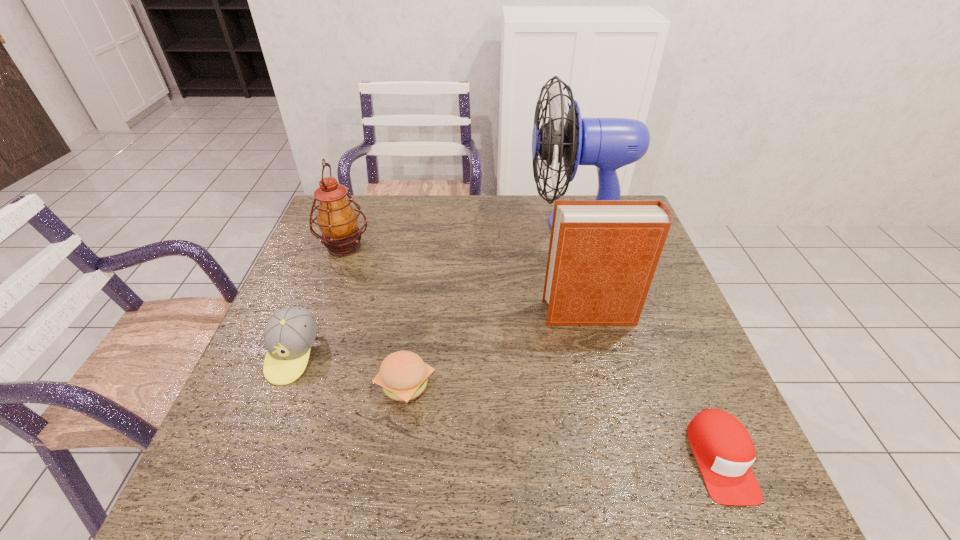
You are a GUI agent. You are given a task and a screenshot of the screen. Output one action in this format:
    pyautogui.click(x=<x>, y=<y>)
    Task: Click on the oil lamp situated at the left edge
    This screenshot has width=960, height=540.
    Given the screenshot: What is the action you would take?
    pyautogui.click(x=337, y=220)

At what (x,y) coordinates should I click in order to perform the action: click on baseball cap that is positioned at the left edge. Please return your answer as a coordinate pair (x, y). The height and width of the screenshot is (540, 960). Looking at the image, I should click on (290, 332).

This screenshot has width=960, height=540. In order to click on fan that is positioned at the right edge in this screenshot , I will do `click(608, 143)`.

The width and height of the screenshot is (960, 540). I want to click on hardback book that is at the right edge, so click(x=603, y=254).

Find the location of a particular element. The image size is (960, 540). baseball cap that is at the right edge is located at coordinates (724, 451).

In order to click on object located at the far left corner in this screenshot , I will do `click(337, 220)`.

Locate an element on the screen. The height and width of the screenshot is (540, 960). object that is at the far right corner is located at coordinates (608, 143).

Locate an element on the screen. object located in the near right corner section of the desktop is located at coordinates (724, 451).

Where is `free space at the far edge`? The image size is (960, 540). free space at the far edge is located at coordinates (537, 197).

Locate an element on the screen. The width and height of the screenshot is (960, 540). free space at the near edge of the desktop is located at coordinates (662, 488).